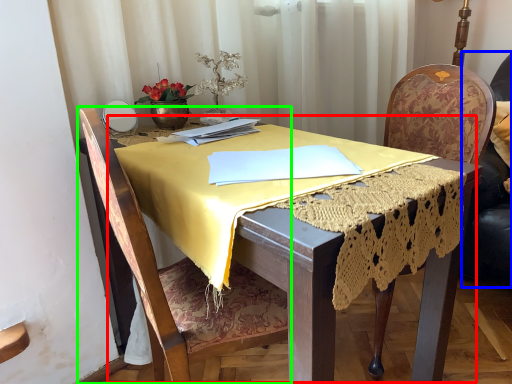
Question: Which object is positioned closest to round table (highlighted by a red box)? Select from swivel chair (highlighted by a blue box) and chair (highlighted by a green box).

Choices:
 (A) swivel chair
 (B) chair

Answer: (B)